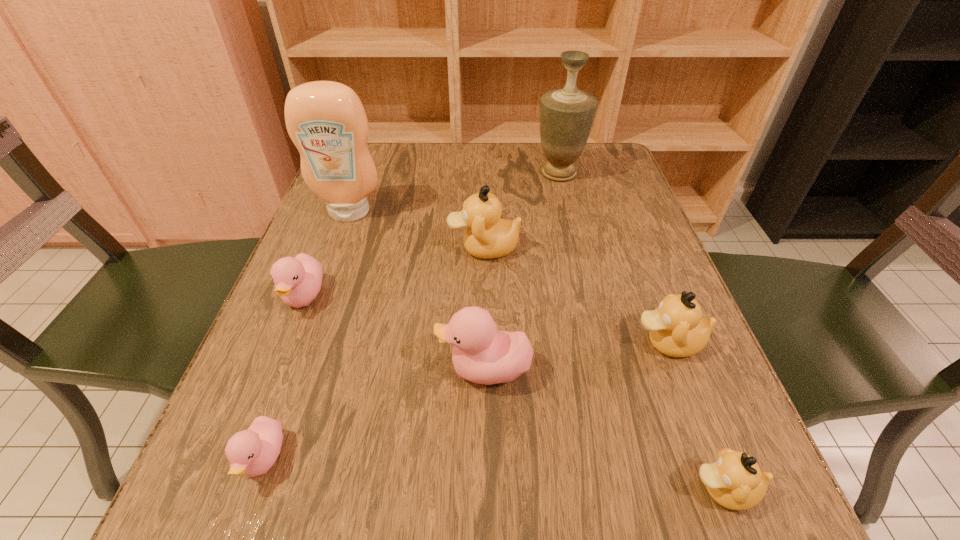
You are a GUI agent. You are given a task and a screenshot of the screen. Output one action in this format:
    pyautogui.click(x=<x>, y=<y>)
    Task: Click on the shortest duckling
    Image resolution: width=960 pixels, height=540 pixels.
    Given the screenshot: What is the action you would take?
    pyautogui.click(x=252, y=452)

Where is `the shortest object`? The width and height of the screenshot is (960, 540). the shortest object is located at coordinates (252, 452).

At what (x,y) coordinates should I click in order to perform the action: click on vacant area located 0.270m on the front of the farthest object. Please return your answer as a coordinate pair (x, y). The width and height of the screenshot is (960, 540). Looking at the image, I should click on (580, 259).

Where is `free space located on the label of the condiment`? free space located on the label of the condiment is located at coordinates (315, 308).

Find the location of a particular element. blank space located 0.070m on the face of the sixth nearest object is located at coordinates (415, 248).

Find the location of a particular element. vacant space situated 0.080m on the face of the sixth nearest object is located at coordinates (410, 248).

Find the location of a particular element. vacant position located on the face of the sixth nearest object is located at coordinates (400, 248).

At what (x,y) coordinates should I click in order to perform the action: click on vacant point located 0.220m on the front-facing side of the biggest pink duckling. Please return your answer as a coordinate pair (x, y). The width and height of the screenshot is (960, 540). Looking at the image, I should click on (300, 370).

Identify the location of vacant space located 0.280m on the front-facing side of the biggest pink duckling. This screenshot has width=960, height=540. (263, 370).

Find the location of a particular element. The width and height of the screenshot is (960, 540). free point located on the front-facing side of the biggest pink duckling is located at coordinates (300, 370).